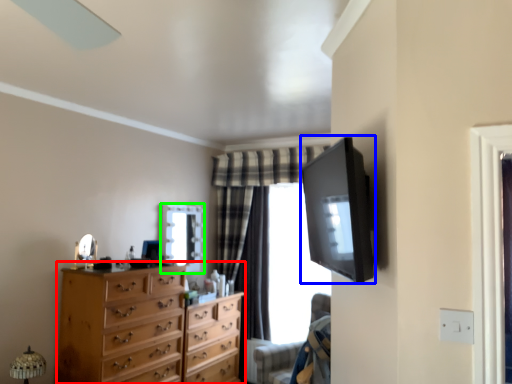
Question: Estimate the real-world distances between objects in this image. Which object is closer to chest of drawers (highlighted by a red box), television (highlighted by a blue box) or mirror (highlighted by a green box)?

Choices:
 (A) television
 (B) mirror

Answer: (B)